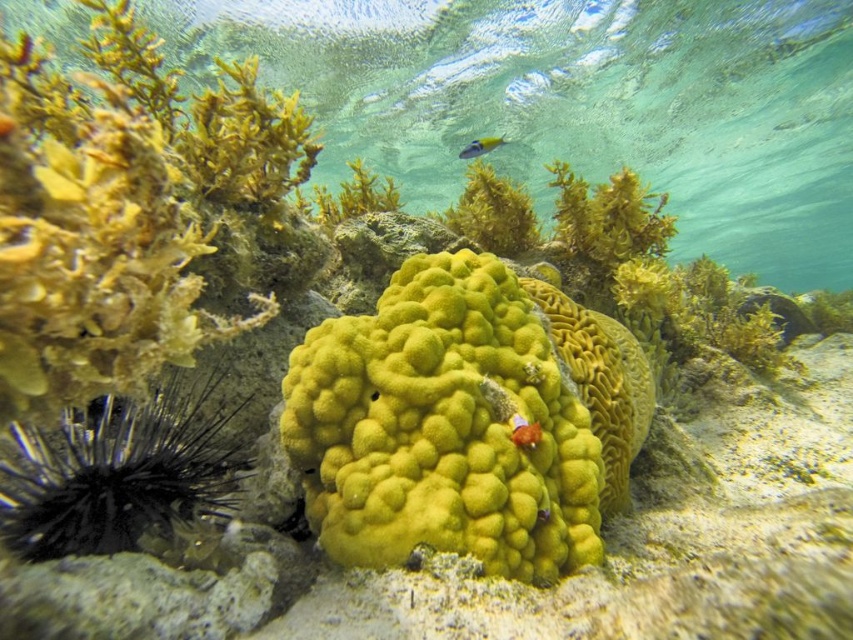
Who is higher up, green coral at center or black spiny sea urchin at left?

green coral at center is higher up.

Can you confirm if green coral at center is positioned to the right of black spiny sea urchin at left?

No, green coral at center is not to the right of black spiny sea urchin at left.

The image size is (853, 640). What are the coordinates of `green coral at center` in the screenshot? It's located at (576, 104).

This screenshot has width=853, height=640. Identify the location of green coral at center. (576, 104).

Which is more to the left, green fuzzy algae at upper center or yellow-green textured fish at upper center?

green fuzzy algae at upper center is more to the left.

Is point (515, 248) in front of point (494, 136)?

Yes, point (515, 248) is in front of point (494, 136).

Does point (492, 200) come farther from viewer compared to point (471, 147)?

No, it is not.

Image resolution: width=853 pixels, height=640 pixels. What are the coordinates of `green fuzzy algae at upper center` in the screenshot? It's located at (492, 212).

Between green matte algae at upper center and yellow-green textured fish at upper center, which one is positioned lower?

green matte algae at upper center is below.

From the picture: Who is shorter, green matte algae at upper center or yellow-green textured fish at upper center?

yellow-green textured fish at upper center is shorter.

What do you see at coordinates (608, 218) in the screenshot? I see `green matte algae at upper center` at bounding box center [608, 218].

This screenshot has width=853, height=640. In order to click on green matte algae at upper center in this screenshot , I will do `click(608, 218)`.